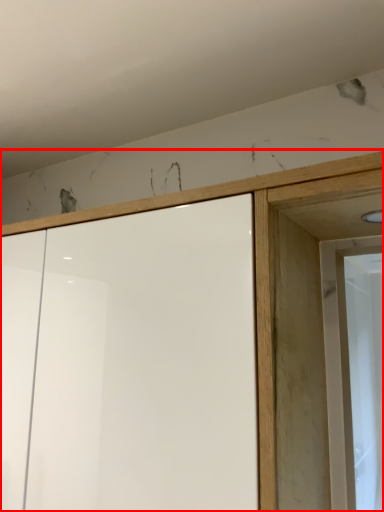
Question: From the image's perspective, where is cupboard (annotated by the red box) located relative to screen door?

Choices:
 (A) below
 (B) above

Answer: (A)